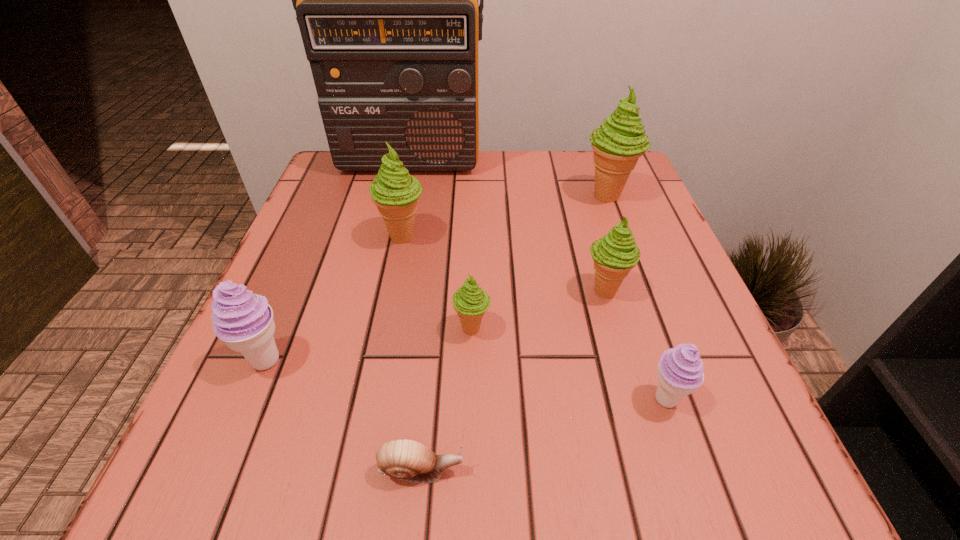
Where is `the smallest green icecream`? This screenshot has width=960, height=540. the smallest green icecream is located at coordinates (470, 302).

I want to click on the second green icecream from left to right, so click(x=470, y=302).

The height and width of the screenshot is (540, 960). What are the coordinates of `the right purple icecream` in the screenshot? It's located at (680, 370).

Locate an element on the screen. the nearest object is located at coordinates (405, 459).

At what (x,y) coordinates should I click in order to perform the action: click on the shortest object. Please return your answer as a coordinate pair (x, y). The width and height of the screenshot is (960, 540). Looking at the image, I should click on (405, 459).

In order to click on free region located on the front-facing side of the radio receiver in this screenshot , I will do `click(395, 225)`.

This screenshot has width=960, height=540. I want to click on vacant space located 0.160m on the left of the farthest green icecream, so click(511, 195).

Identify the location of free space located 0.230m on the back of the third nearest green icecream. (418, 166).

Find the location of `free region located on the back of the second smallest green icecream`. free region located on the back of the second smallest green icecream is located at coordinates (590, 238).

Identify the location of free point located on the right of the left purple icecream. (502, 360).